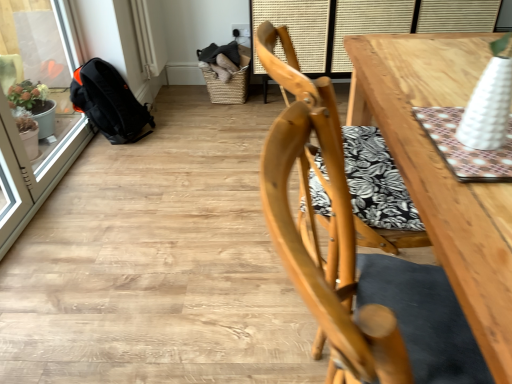
Where is `unoccupied area in front of black fabric backpack at left`? unoccupied area in front of black fabric backpack at left is located at coordinates (115, 159).